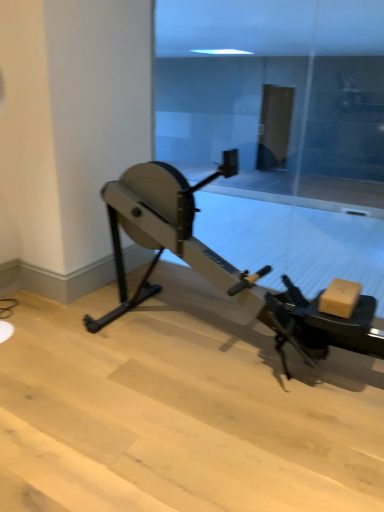
What do you see at coordinates (279, 98) in the screenshot?
I see `transparent glass door at center` at bounding box center [279, 98].

You are a GUI agent. You are given a task and a screenshot of the screen. Output one action in this format:
    pyautogui.click(x=<x>, y=<y>)
    Task: Click on the transparent glass door at center
    
    Given the screenshot: What is the action you would take?
    [279, 98]

Find the location of `metallic gray stationary bicycle at center`. metallic gray stationary bicycle at center is located at coordinates (221, 265).

In order to face metallic gray stationary bicycle at center, should I rotate leftwards or rightwards?

Rotate your view right by about 6.025°.

What do you see at coordinates (221, 265) in the screenshot?
I see `metallic gray stationary bicycle at center` at bounding box center [221, 265].

Locate an element on the screen. Image resolution: width=384 pixels, height=512 pixels. transparent glass door at center is located at coordinates (279, 98).

Which object is positioned more to the right, transparent glass door at center or metallic gray stationary bicycle at center?

Positioned to the right is transparent glass door at center.

Relative to metallic gray stationary bicycle at center, is transparent glass door at center in front or behind?

transparent glass door at center is behind metallic gray stationary bicycle at center.

Is point (295, 144) positioned before point (231, 293)?

No, it is behind (231, 293).

From the image's perspective, would you say transparent glass door at center is shown under metallic gray stationary bicycle at center?

No.

From a real-world perspective, who is located lower, transparent glass door at center or metallic gray stationary bicycle at center?

metallic gray stationary bicycle at center is physically lower.

Considering the sizes of objects transparent glass door at center and metallic gray stationary bicycle at center in the image provided, who is wider, transparent glass door at center or metallic gray stationary bicycle at center?

metallic gray stationary bicycle at center is wider.

From their relative heights in the image, would you say transparent glass door at center is taller or shorter than metallic gray stationary bicycle at center?

In the image, transparent glass door at center appears to be taller than metallic gray stationary bicycle at center.

Between transparent glass door at center and metallic gray stationary bicycle at center, which one has larger size?

With larger size is metallic gray stationary bicycle at center.

Is transparent glass door at center not inside metallic gray stationary bicycle at center?

Indeed, transparent glass door at center is completely outside metallic gray stationary bicycle at center.

Is transparent glass door at center directly adjacent to metallic gray stationary bicycle at center?

transparent glass door at center and metallic gray stationary bicycle at center are not in contact.

Could you tell me if transparent glass door at center is turned towards metallic gray stationary bicycle at center?

Yes, transparent glass door at center faces towards metallic gray stationary bicycle at center.

From the picture: How much distance is there between transparent glass door at center and metallic gray stationary bicycle at center?

3.30 meters.

At what (x,y) coordinates should I click in order to perform the action: click on glass door on the right of metallic gray stationary bicycle at center. Please return your answer as a coordinate pair (x, y). Looking at the image, I should click on (279, 98).

Considering the positions of objects metallic gray stationary bicycle at center and transparent glass door at center in the image provided, who is more to the left, metallic gray stationary bicycle at center or transparent glass door at center?

From the viewer's perspective, metallic gray stationary bicycle at center appears more on the left side.

Based on the photo, is the position of metallic gray stationary bicycle at center less distant than that of transparent glass door at center?

Yes.

Does point (111, 321) come farther from viewer compared to point (320, 191)?

That is False.

Looking at this image, from the image's perspective, which is below, metallic gray stationary bicycle at center or transparent glass door at center?

From the image's view, metallic gray stationary bicycle at center is below.

From a real-world perspective, is metallic gray stationary bicycle at center on transparent glass door at center?

No, from a real-world perspective, metallic gray stationary bicycle at center is not above transparent glass door at center.

Consider the image. Considering the sizes of objects metallic gray stationary bicycle at center and transparent glass door at center in the image provided, who is thinner, metallic gray stationary bicycle at center or transparent glass door at center?

Thinner between the two is transparent glass door at center.

Between metallic gray stationary bicycle at center and transparent glass door at center, which one has more height?

Standing taller between the two is transparent glass door at center.

Considering the relative sizes of metallic gray stationary bicycle at center and transparent glass door at center in the image provided, is metallic gray stationary bicycle at center smaller than transparent glass door at center?

Actually, metallic gray stationary bicycle at center might be larger than transparent glass door at center.

Is metallic gray stationary bicycle at center inside the boundaries of transparent glass door at center, or outside?

metallic gray stationary bicycle at center is not inside transparent glass door at center, it's outside.

Is metallic gray stationary bicycle at center not close to transparent glass door at center?

metallic gray stationary bicycle at center is positioned a significant distance from transparent glass door at center.

Is metallic gray stationary bicycle at center looking in the opposite direction of transparent glass door at center?

That's right, metallic gray stationary bicycle at center is facing away from transparent glass door at center.

Locate an element on the screen. The width and height of the screenshot is (384, 512). glass door that appears above the metallic gray stationary bicycle at center (from the image's perspective) is located at coordinates (279, 98).

Find the location of a particular element. The width and height of the screenshot is (384, 512). glass door lying behind the metallic gray stationary bicycle at center is located at coordinates (279, 98).

This screenshot has height=512, width=384. I want to click on stationary bicycle in front of the transparent glass door at center, so click(221, 265).